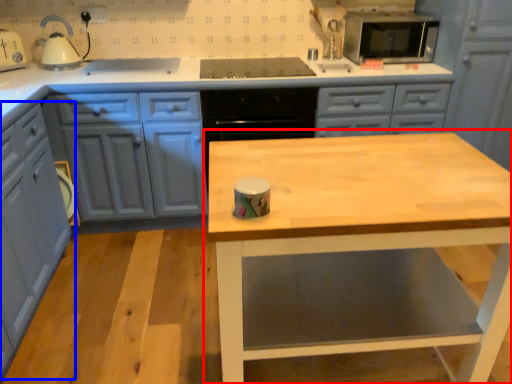
Question: Which object is closer to the camera taking this photo, table (highlighted by a red box) or cabinetry (highlighted by a blue box)?

Choices:
 (A) table
 (B) cabinetry

Answer: (A)